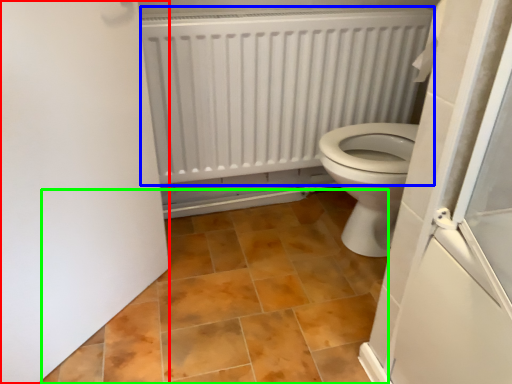
Question: Considering the real-world distances, which object is farthest from door (highlighted by a red box)? radiator (highlighted by a blue box) or ceramic tile (highlighted by a green box)?

Choices:
 (A) radiator
 (B) ceramic tile

Answer: (A)